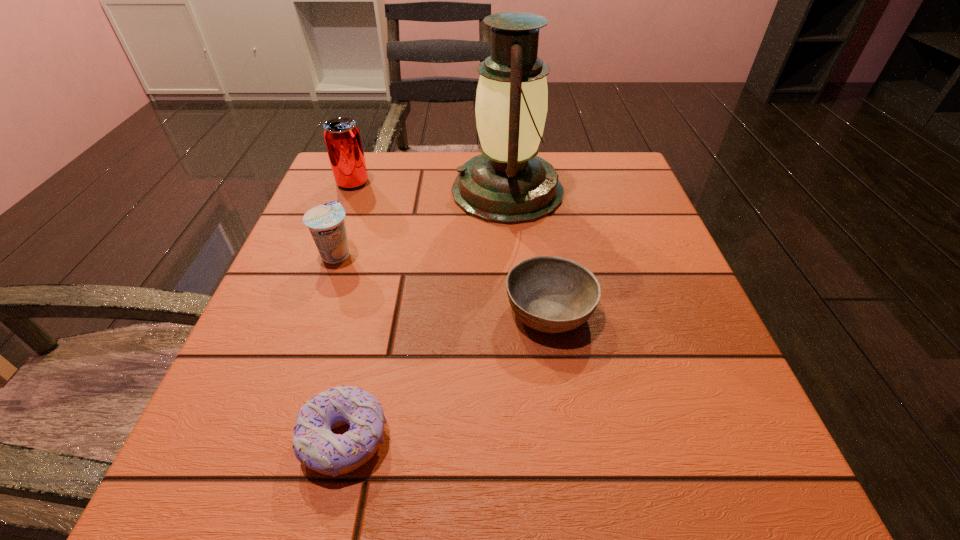
Locate an element on the screen. free spot between the fourth shortest object and the shortest object is located at coordinates (348, 310).

In order to click on free space between the second tallest object and the bowl in this screenshot , I will do `click(451, 246)`.

Identify the location of free space between the third object from left to right and the tallest object. This screenshot has width=960, height=540. (426, 315).

The image size is (960, 540). In order to click on vacant point located between the third object from right to left and the third nearest object in this screenshot , I will do `click(341, 346)`.

The image size is (960, 540). I want to click on free space between the second nearest object and the tallest object, so click(529, 251).

Image resolution: width=960 pixels, height=540 pixels. I want to click on free area in between the third shortest object and the nearest object, so click(341, 346).

I want to click on unoccupied area between the bowl and the third farthest object, so click(443, 282).

Where is `free space between the third nearest object and the third object from right to left`? free space between the third nearest object and the third object from right to left is located at coordinates (341, 346).

You are a GUI agent. You are given a task and a screenshot of the screen. Output one action in this format:
    pyautogui.click(x=<x>, y=<y>)
    Task: Click on the empty location between the fourth shortest object and the nearest object
    The width and height of the screenshot is (960, 540).
    Given the screenshot: What is the action you would take?
    pyautogui.click(x=348, y=310)

Select which object appears as the closest to the tallest object. Please provide its 2D coordinates. Your answer should be formatted as a tuple, i.e. [(x, y)], where the tuple contains the x and y coordinates of a point satisfying the conditions above.

[(551, 294)]